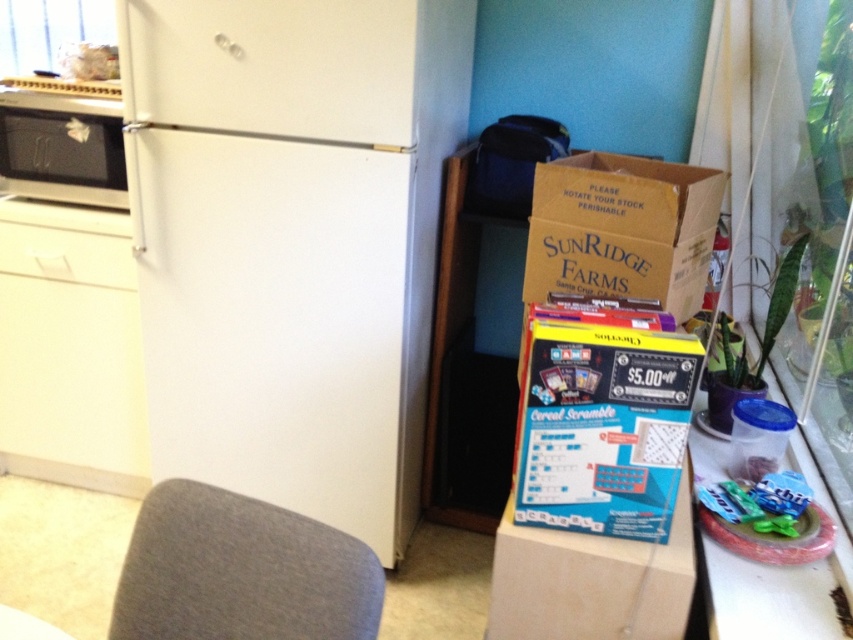
Does white matte refrigerator at left appear under matte black microwave at left?

Correct, white matte refrigerator at left is located below matte black microwave at left.

Image resolution: width=853 pixels, height=640 pixels. I want to click on white matte refrigerator at left, so click(x=294, y=243).

Which is behind, point (169, 40) or point (729, 618)?

The point (169, 40) is more distant.

Does point (196, 442) come farther from viewer compared to point (822, 568)?

That is True.

I want to click on white matte refrigerator at left, so click(294, 243).

Between gray fabric chair at lower left and matte black microwave at left, which one appears on the right side from the viewer's perspective?

Positioned to the right is gray fabric chair at lower left.

How far apart are gray fabric chair at lower left and matte black microwave at left?

gray fabric chair at lower left and matte black microwave at left are 4.69 feet apart from each other.

Is point (288, 522) farther from viewer compared to point (94, 157)?

No.

The height and width of the screenshot is (640, 853). What are the coordinates of `gray fabric chair at lower left` in the screenshot? It's located at (241, 572).